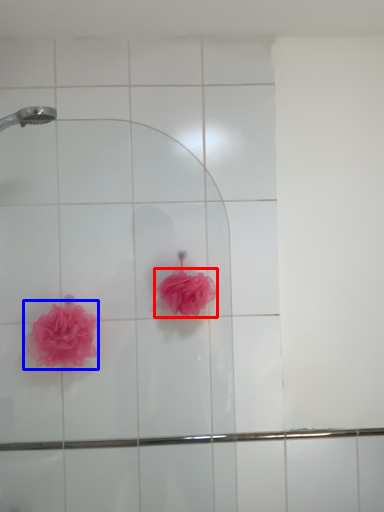
Question: Which object is closer to the camera taking this photo, rose (highlighted by a red box) or rose (highlighted by a blue box)?

Choices:
 (A) rose
 (B) rose

Answer: (B)